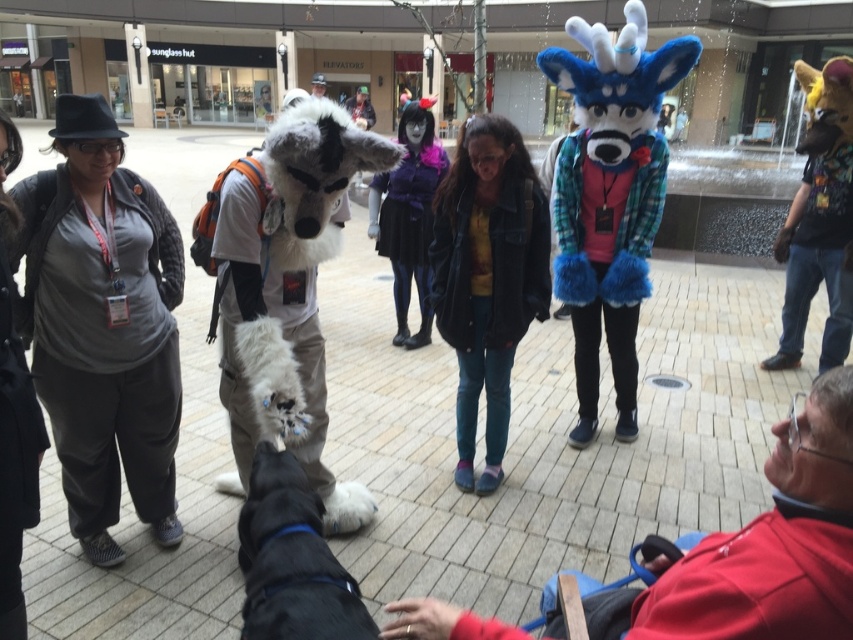
Who is taller, denim jacket at center or velvet blue plush at lower right?

denim jacket at center

Based on the photo, who is positioned more to the right, denim jacket at center or velvet blue plush at lower right?

velvet blue plush at lower right is more to the right.

Where is `denim jacket at center`? This screenshot has width=853, height=640. denim jacket at center is located at coordinates click(x=486, y=278).

Who is shorter, white fluffy dog at center or black furry costume at left?

With less height is black furry costume at left.

Is white fluffy dog at center closer to camera compared to black furry costume at left?

No, it is behind black furry costume at left.

The width and height of the screenshot is (853, 640). What do you see at coordinates (289, 292) in the screenshot?
I see `white fluffy dog at center` at bounding box center [289, 292].

Locate an element on the screen. The height and width of the screenshot is (640, 853). white fluffy dog at center is located at coordinates (289, 292).

Does denim jacket at center have a greater width compared to matte black hat at upper left?

Incorrect, denim jacket at center's width does not surpass matte black hat at upper left's.

Is point (438, 196) positioned after point (320, 74)?

No, (438, 196) is in front of (320, 74).

I want to click on denim jacket at center, so click(486, 278).